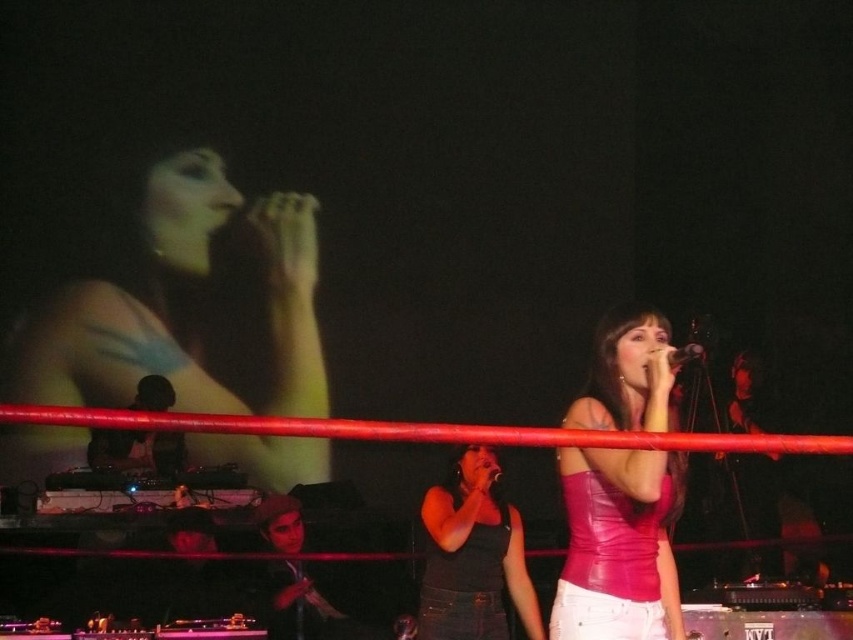
You are a stagehand setting up equipment for a performance. You have a matte black microphone at upper left and a pink leather top at center. Which object is bigger?

The matte black microphone at upper left is larger in size than the pink leather top at center.

You are a photographer at this concert. You need to capture a photo where both the matte black microphone at upper left and the matte black tank top at center are clearly visible. Based on their positions, which object is located to the left of the other?

The matte black microphone at upper left is positioned on the left side of matte black tank top at center, so the microphone is to the left of the tank top.